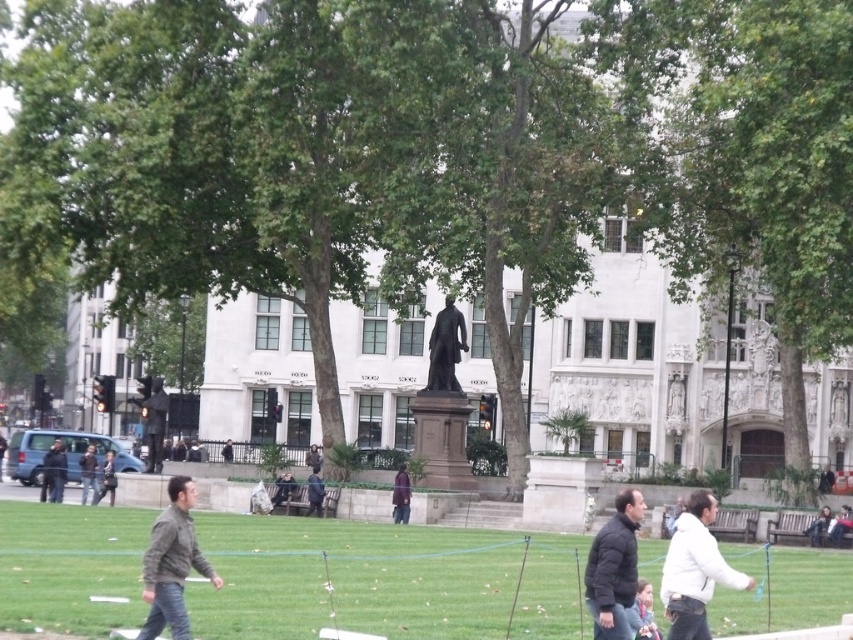
You are a GUI agent. You are given a task and a screenshot of the screen. Output one action in this format:
    pyautogui.click(x=<x>, y=<y>)
    Task: Click on the black puffy jacket at lower right
    The height and width of the screenshot is (640, 853).
    Given the screenshot: What is the action you would take?
    pyautogui.click(x=614, y=566)

How distant is black puffy jacket at lower right from dark blue jeans at lower left?

black puffy jacket at lower right is 51.99 meters away from dark blue jeans at lower left.

The height and width of the screenshot is (640, 853). Find the location of `black puffy jacket at lower right`. black puffy jacket at lower right is located at coordinates (614, 566).

Where is `black puffy jacket at lower right`? black puffy jacket at lower right is located at coordinates (614, 566).

Is black polished statue at center closer to camera compared to white marble statue at center?

That is True.

Between black polished statue at center and white marble statue at center, which one appears on the right side from the viewer's perspective?

Positioned to the right is white marble statue at center.

Describe the element at coordinates (445, 348) in the screenshot. I see `black polished statue at center` at that location.

In order to click on black polished statue at center in this screenshot , I will do `click(445, 348)`.

Is the position of camouflage jacket at lower left less distant than that of dark blue jeans at lower left?

Yes.

Where is `camouflage jacket at lower left`? camouflage jacket at lower left is located at coordinates (172, 563).